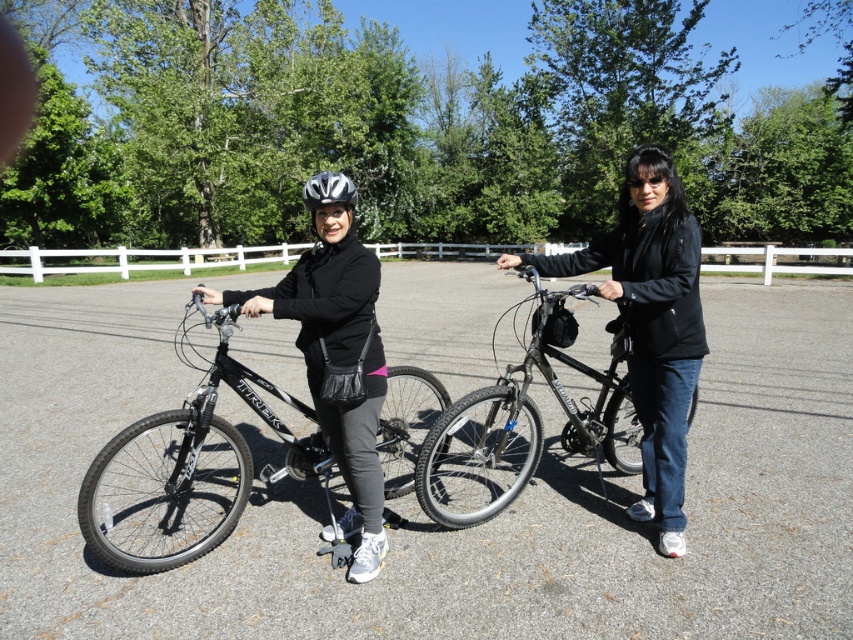
You are a delivery person who needs to load both the matte black bicycle at center and the shiny black bicycle at center onto a truck. The truck has a loading ramp that only allows items to be placed on top of each other if the lower item is larger in size. Which bicycle should you place first on the truck bed to comply with the loading rule?

The matte black bicycle at center should be placed first on the truck bed because it is positioned over the shiny black bicycle at center, indicating it is larger in size and must be placed below to follow the loading rule.

You are a delivery person who needs to place both the matte black bicycle at center and the shiny black bicycle at center into a storage container that is 4 inches wide. Can both bicycles fit side by side in the container?

The matte black bicycle at center is 4.33 inches away from the shiny black bicycle at center. Since the total space required between them is 4.33 inches and the container is only 4 inches wide, the bicycles cannot fit side by side in the container.

You are standing in the scene and want to place a new bench between the two points, point (305, 314) and point (589, 403). Which point should the bench be closer to in order to be nearer to the foreground?

The bench should be placed closer to point (305, 314) because it is closer to the camera than point (589, 403).